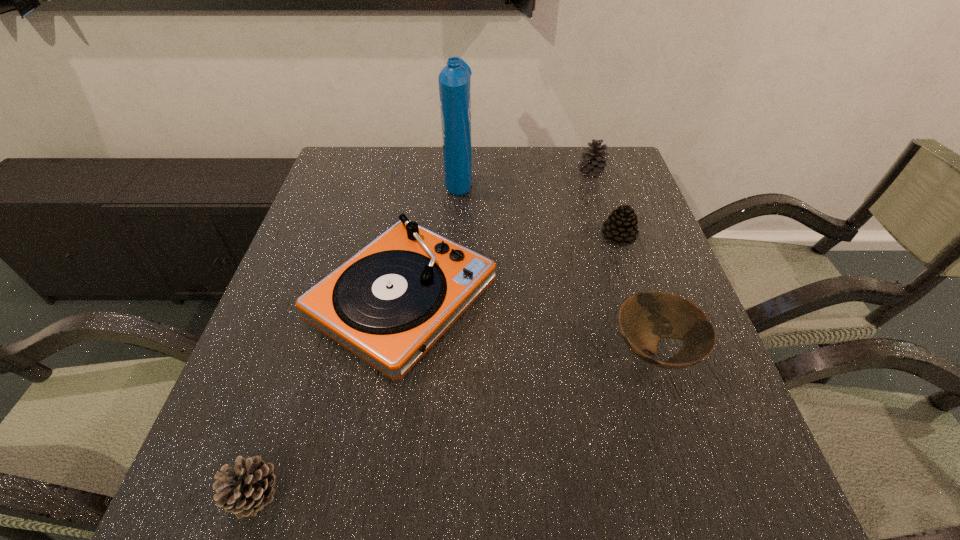
In order to click on vacant space located 0.080m on the front of the record player in this screenshot , I will do `click(382, 424)`.

What are the coordinates of `free space located on the front of the bowl` in the screenshot? It's located at (685, 449).

Locate an element on the screen. The image size is (960, 540). free point located on the right of the nearest pinecone is located at coordinates (446, 494).

Identify the location of shampoo that is at the far edge. This screenshot has height=540, width=960. (454, 80).

Image resolution: width=960 pixels, height=540 pixels. In order to click on pinecone positioned at the far edge in this screenshot , I will do `click(593, 163)`.

The width and height of the screenshot is (960, 540). I want to click on object that is positioned at the near edge, so click(x=249, y=487).

Find the location of a particular element. This screenshot has height=540, width=960. record player at the left edge is located at coordinates coord(388,304).

Locate an element on the screen. pinecone present at the left edge is located at coordinates (249, 487).

At what (x,y) coordinates should I click in order to perform the action: click on bowl at the right edge. Please return your answer as a coordinate pair (x, y). Image resolution: width=960 pixels, height=540 pixels. Looking at the image, I should click on point(644,318).

The width and height of the screenshot is (960, 540). Identify the location of object that is positioned at the near left corner. (249, 487).